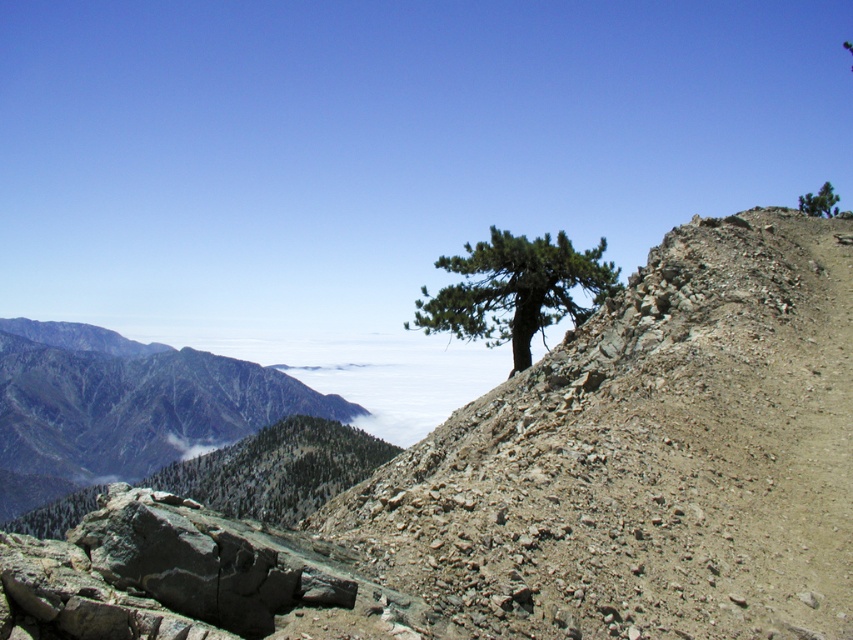
You are a hiker trying to navigate the mountain path. You see two landmarks marked as point (164, 376) and point (804, 211). Which point is closer to your current position?

Point (164, 376) is closer to your current position because it is further to the viewer than point (804, 211).

Consider the image. You are standing at the base of the mountain looking up at the rugged terrain. You notice two points marked on the slope. The first point is at coordinates point (540,236) and the second is at point (805,200). Which of these two points is higher up the slope?

Point (805,200) is higher up the slope because it is farther from the camera compared to point (540,236), which is closer.

You are a hiker planning to climb both the gray rocky mountain at left and the green textured tree at upper center. Based on their heights, which one should you attempt first?

The gray rocky mountain at left is much taller than the green textured tree at upper center, so you should attempt the green textured tree at upper center first since it is shorter and likely easier to climb.